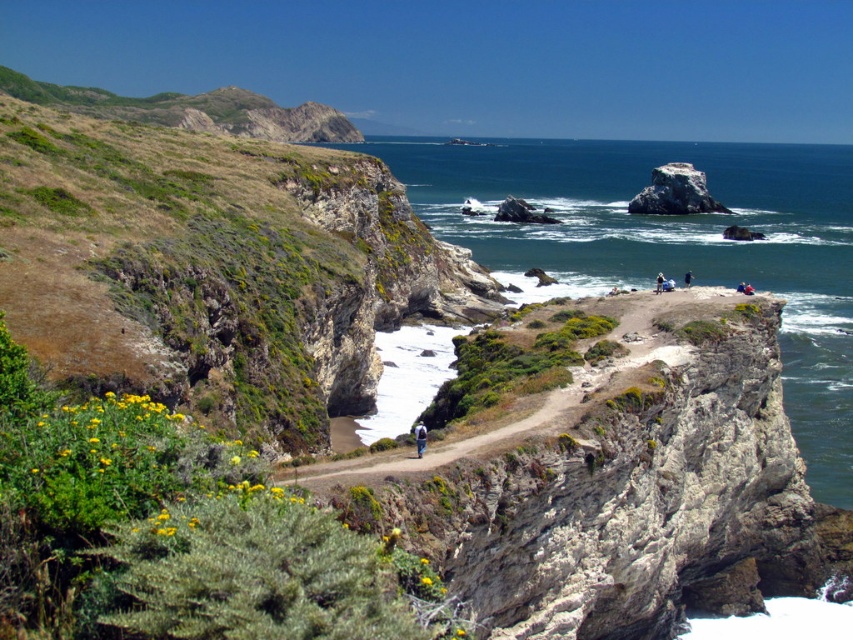
You are a hiker standing on the cliff edge looking at the clear blue water at upper center and the white fabric at center. Which object appears taller from your viewpoint?

The clear blue water at upper center appears taller than the white fabric at center because it has a greater height compared to the white fabric at center.